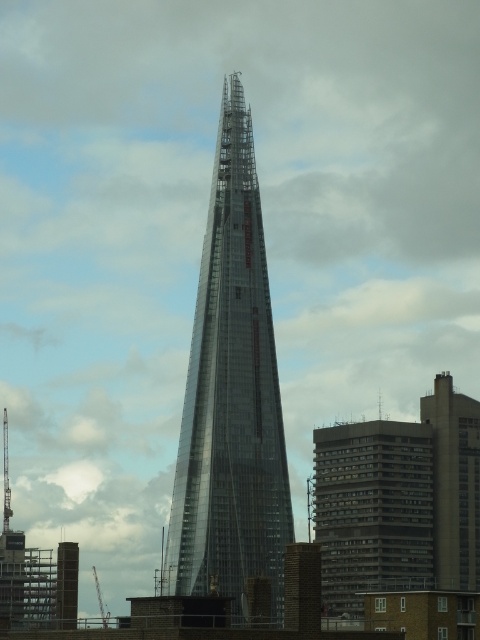
From the picture: Who is more forward, (254, 198) or (7, 433)?

Point (254, 198) is in front.

Between transparent glass tower at center and transparent glass spire at left, which one has less height?

transparent glass spire at left is shorter.

Where is `transparent glass tower at center`? This screenshot has width=480, height=640. transparent glass tower at center is located at coordinates (230, 396).